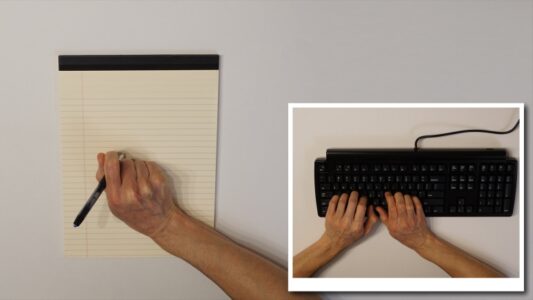
I want to click on keyboard, so click(415, 183).